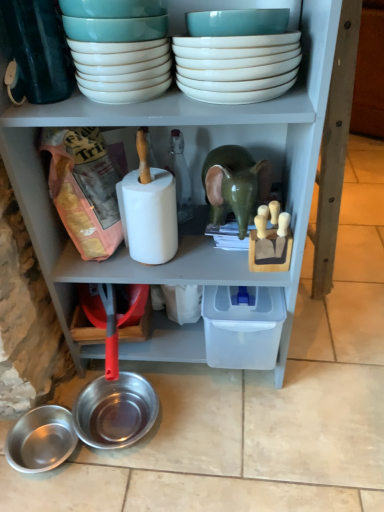
Locate an element on the screen. Image resolution: width=384 pixels, height=512 pixels. vacant region under shiny metallic bowl at lower left, arranged as the first bowl when ordered from the bottom (from a real-world perspective) is located at coordinates (51, 452).